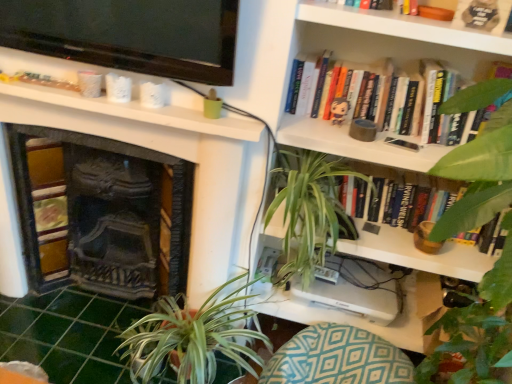
Question: In terms of width, does hardcover book at upper right, the third book from the bottom, look wider or thinner when compared to teal diamond-patterned cushion at lower center?

Choices:
 (A) thin
 (B) wide

Answer: (A)

Question: Considering the positions of point (301, 9) and point (279, 367), is point (301, 9) closer or farther from the camera than point (279, 367)?

Choices:
 (A) farther
 (B) closer

Answer: (B)

Question: Which object is the farthest from the green leafy plant at upper right, which appears as the second vegetation when viewed from the left?

Choices:
 (A) teal diamond-patterned cushion at lower center
 (B) hardcover book at center, which ranks as the third book in top-to-bottom order
 (C) green leafy plant at lower left
 (D) matte plastic toy at upper center
 (E) white glossy bookshelf at upper right

Answer: (D)

Question: Estimate the real-world distances between objects in this image. Which object is farther from the hardcover book at upper right, positioned as the 2th book in bottom-to-top order?

Choices:
 (A) green leafy plant at center, placed as the first vegetation when sorted from left to right
 (B) green leafy plant at upper right, the first vegetation from the right
 (C) teal diamond-patterned cushion at lower center
 (D) hardcover book at center, which ranks as the third book in top-to-bottom order
 (E) hardcover book at upper right, which is the first book in top-to-bottom order

Answer: (C)